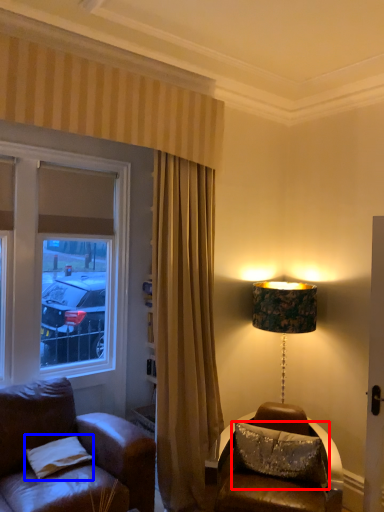
Question: Which of the following is the farthest to the observer, pillow (highlighted by a red box) or pillow (highlighted by a blue box)?

Choices:
 (A) pillow
 (B) pillow

Answer: (A)